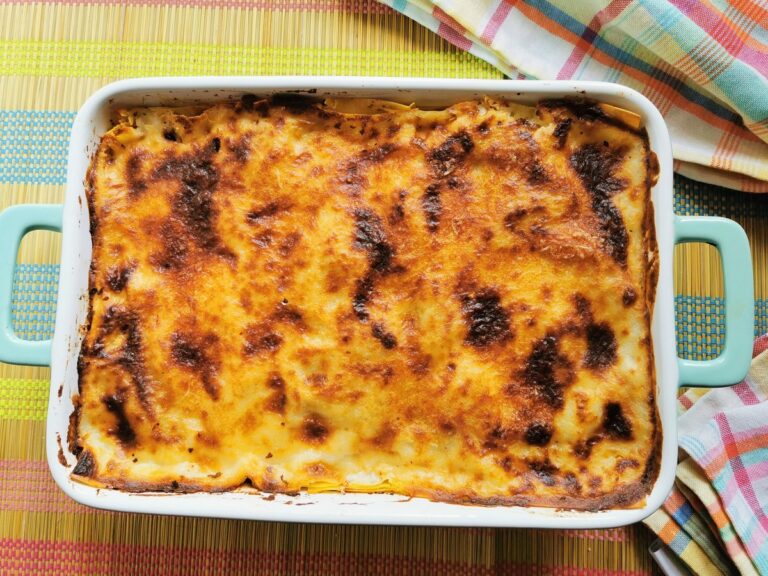
Where is `tablecloth`? Image resolution: width=768 pixels, height=576 pixels. tablecloth is located at coordinates (184, 28), (90, 538).